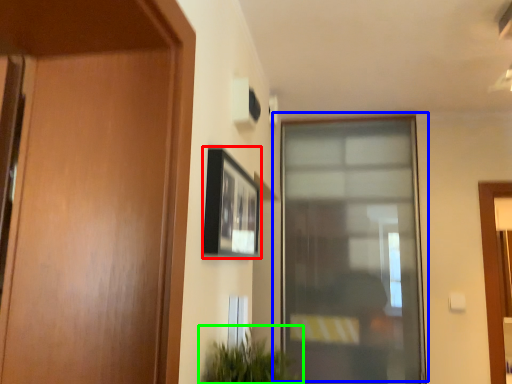
Question: Which object is positioned farthest from picture frame (highlighted by a red box)? Select from window (highlighted by a blue box) and houseplant (highlighted by a green box).

Choices:
 (A) window
 (B) houseplant

Answer: (A)